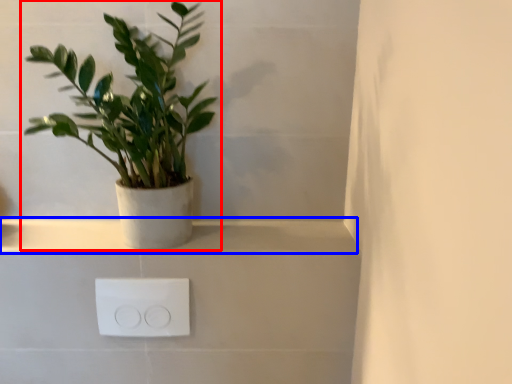
Question: Among these objects, which one is nearest to the camera, houseplant (highlighted by a red box) or window sill (highlighted by a blue box)?

Choices:
 (A) houseplant
 (B) window sill

Answer: (A)